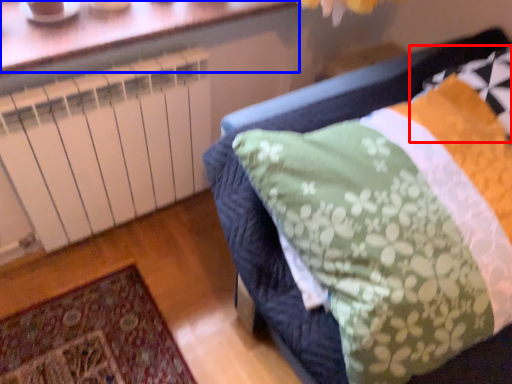
Question: Which object is closer to the camera taking this photo, pillow (highlighted by a red box) or window (highlighted by a blue box)?

Choices:
 (A) pillow
 (B) window

Answer: (A)